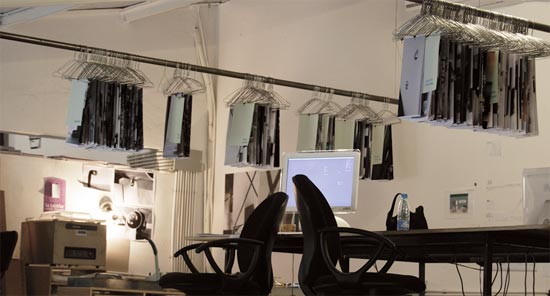
Find the location of `rack`. rack is located at coordinates (152, 61), (541, 26).